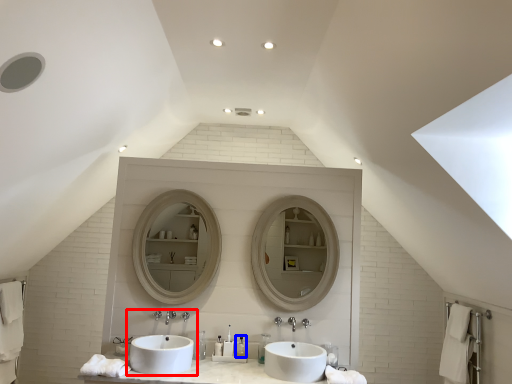
Question: Among these objects, which one is farthest to the camera, sink (highlighted by a red box) or toiletry (highlighted by a blue box)?

Choices:
 (A) sink
 (B) toiletry

Answer: (B)